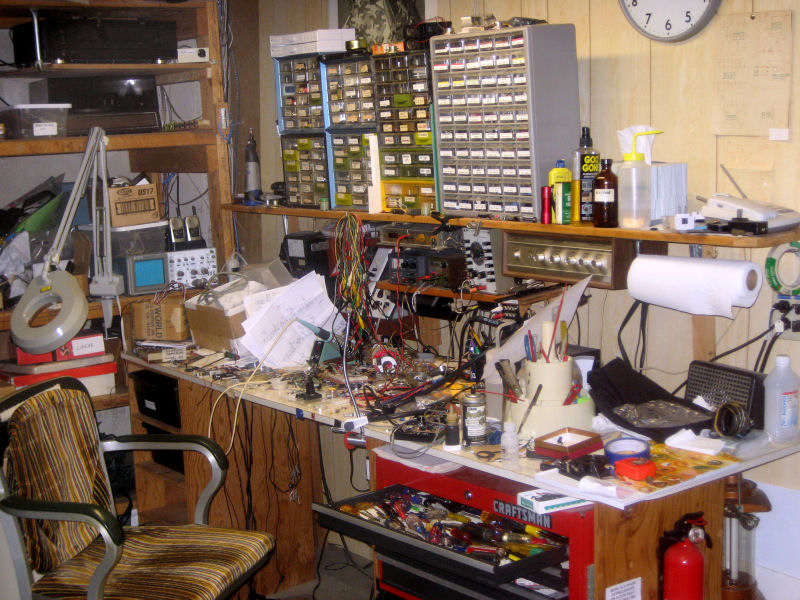
Where is `chair`? The height and width of the screenshot is (600, 800). chair is located at coordinates (70, 475).